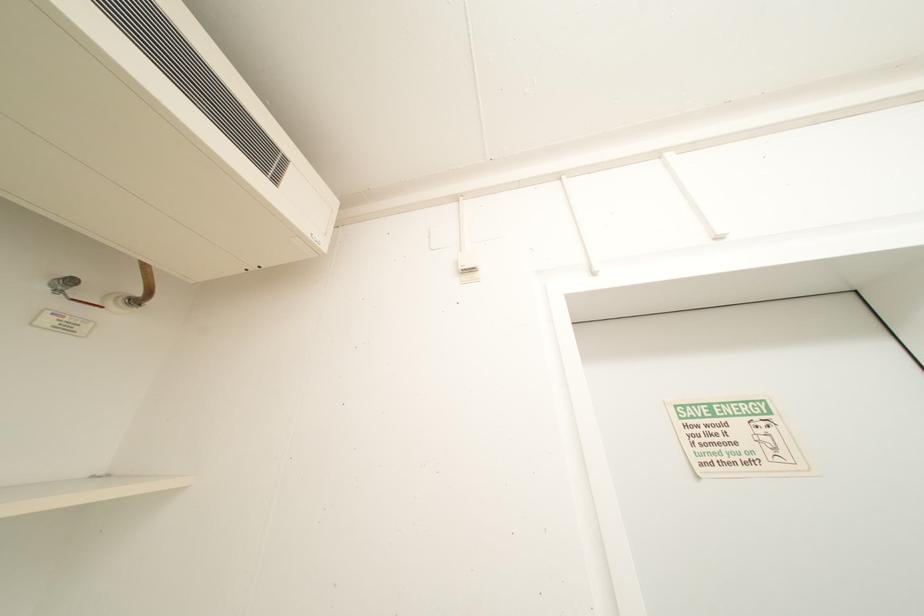
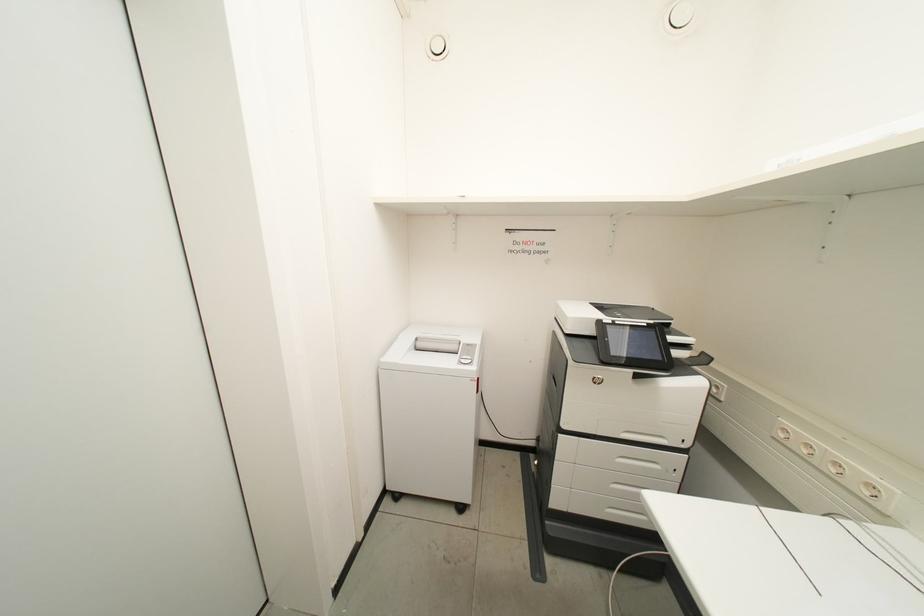
Question: The camera is either moving clockwise (left) or counter-clockwise (right) around the object. The first image is from the beginning of the video and the second image is from the end. Is the camera moving left or right when shooting the video?

Choices:
 (A) Left
 (B) Right

Answer: (A)